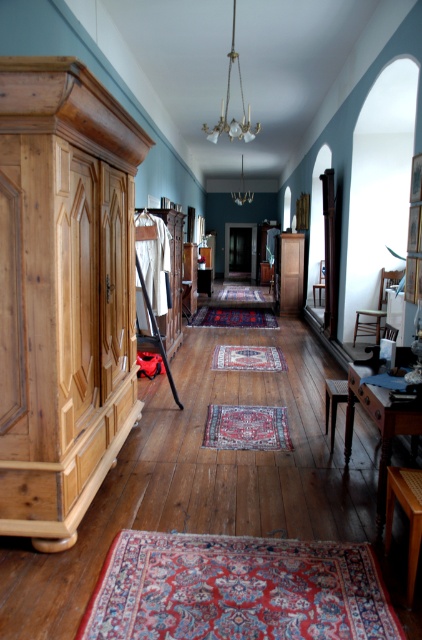
You are standing in the hallway and want to place a new lamp on the wooden table at lower right. However, you notice the brass glass chandelier at upper center above it. Could the lamp be placed there without being directly under the chandelier?

The wooden table at lower right is in front of the brass glass chandelier at upper center, so placing the lamp there would not position it directly under the chandelier. The lamp can be placed safely on the wooden table at lower right without being under the chandelier.